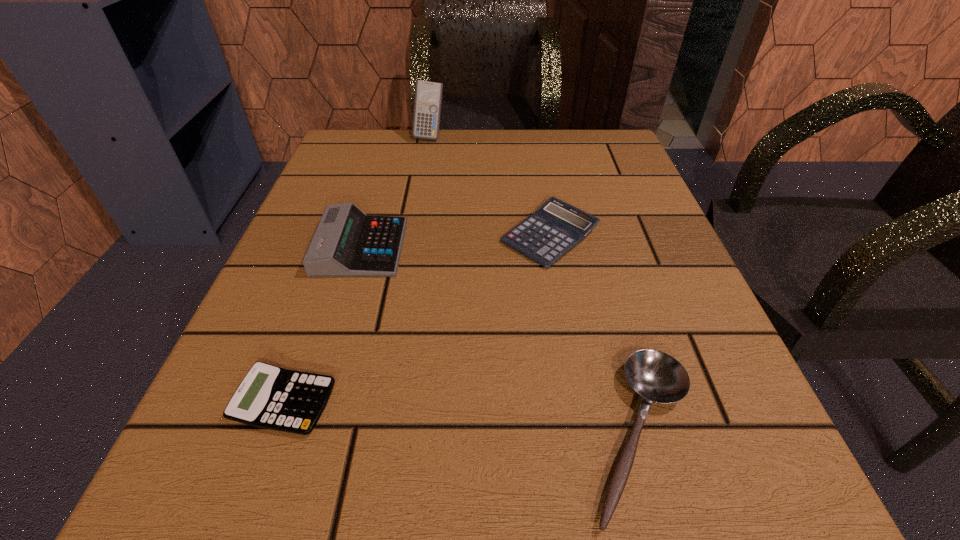
You are a GUI agent. You are given a task and a screenshot of the screen. Output one action in this format:
    pyautogui.click(x=<x>, y=<y>)
    Task: Click on the free region located 0.340m on the left of the ladle
    This screenshot has height=540, width=960.
    Given the screenshot: What is the action you would take?
    pyautogui.click(x=275, y=434)

Where is `object situated at the far edge`? object situated at the far edge is located at coordinates (428, 96).

At what (x,y) coordinates should I click in order to perform the action: click on object at the near edge. Please return your answer as a coordinate pair (x, y). This screenshot has width=960, height=540. Looking at the image, I should click on (657, 377).

Identify the location of calculator situated at the right edge. The height and width of the screenshot is (540, 960). (545, 236).

This screenshot has width=960, height=540. Identify the location of ladle at the right edge. (657, 377).

Identify the location of object positioned at the near right corner. The width and height of the screenshot is (960, 540). (657, 377).

In the image, there is a desktop. Where is `vacant space at the far edge`? This screenshot has width=960, height=540. vacant space at the far edge is located at coordinates (463, 163).

Where is `free location at the near edge of the desktop`? Image resolution: width=960 pixels, height=540 pixels. free location at the near edge of the desktop is located at coordinates (362, 500).

In the image, there is a desktop. At what (x,y) coordinates should I click in order to perform the action: click on vacant space at the left edge. Please return your answer as a coordinate pair (x, y). Image resolution: width=960 pixels, height=540 pixels. Looking at the image, I should click on (308, 196).

Image resolution: width=960 pixels, height=540 pixels. What are the coordinates of `vacant position at the right edge of the desktop` in the screenshot? It's located at (665, 409).